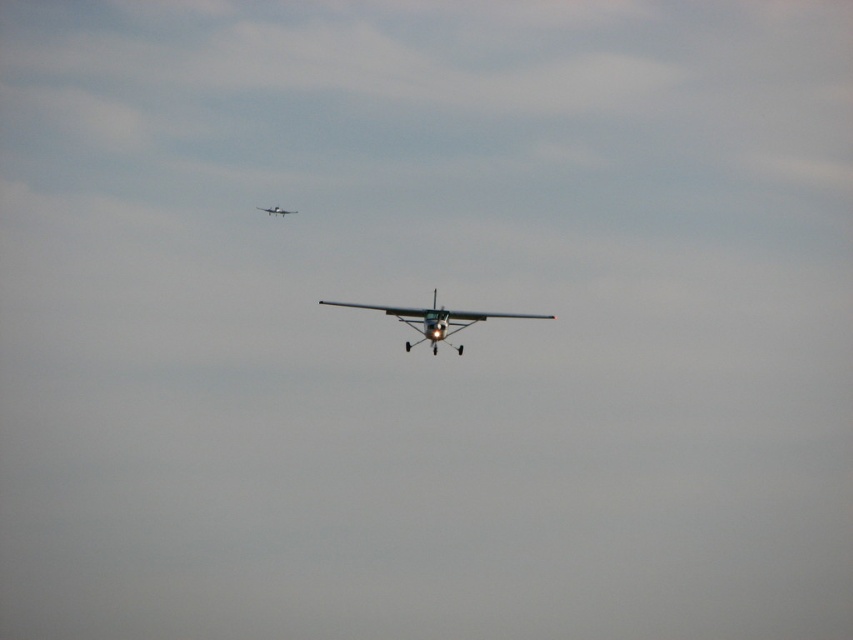
Does point (403, 316) lie behind point (276, 212)?

No, (403, 316) is closer to viewer.

Is metallic silver airplane at center above metallic silver airplane at upper center?

No, metallic silver airplane at center is not above metallic silver airplane at upper center.

Is point (509, 317) positioned behind point (296, 211)?

No, (509, 317) is in front of (296, 211).

This screenshot has height=640, width=853. I want to click on metallic silver airplane at center, so [436, 321].